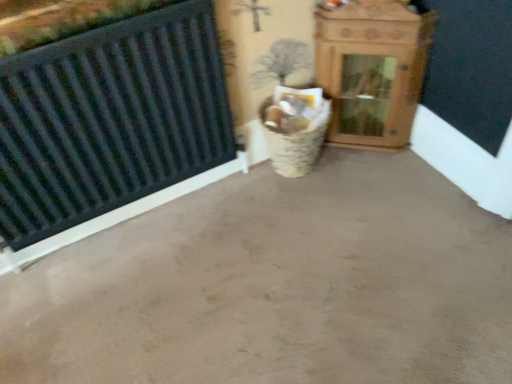
Identify the location of wooden cabinet at upper right. (372, 69).

What do you see at coordinates (372, 69) in the screenshot? The height and width of the screenshot is (384, 512). I see `wooden cabinet at upper right` at bounding box center [372, 69].

Measure the distance between point (357, 125) and camera.

Point (357, 125) is 2.00 meters away from camera.

Locate an element on the screen. The image size is (512, 384). wooden cabinet at upper right is located at coordinates (372, 69).